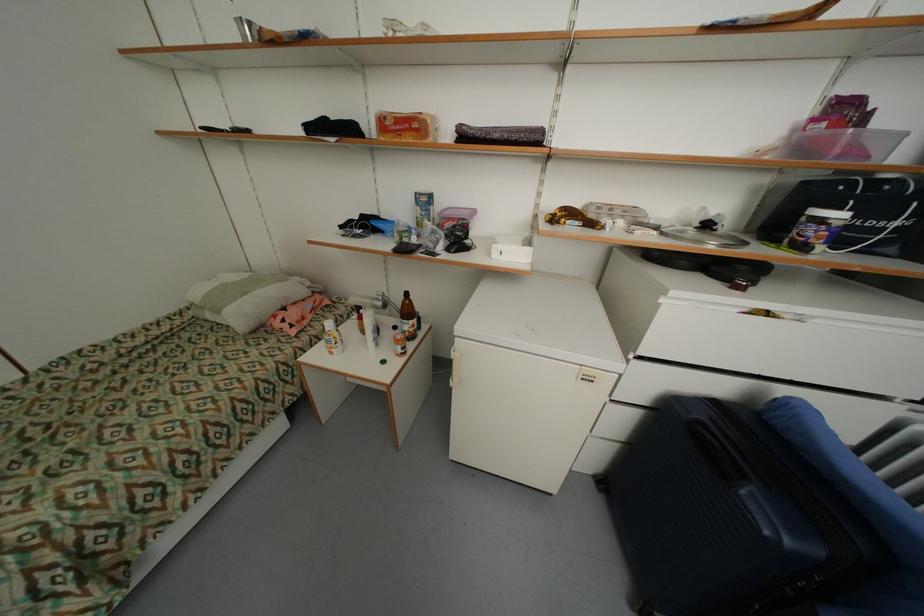
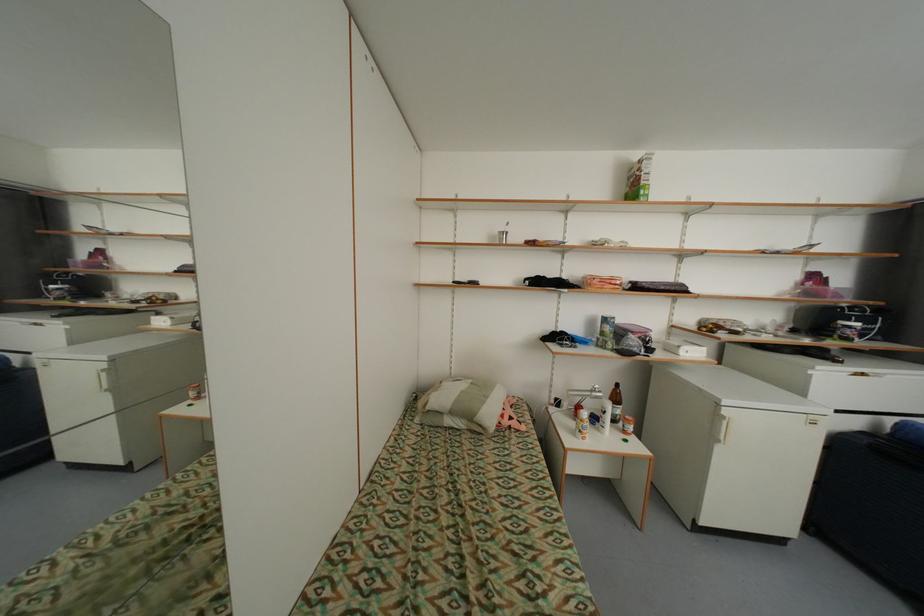
Question: In a continuous first-person perspective shot, in which direction is the camera moving?

Choices:
 (A) Left
 (B) Right
 (C) Forward
 (D) Backward

Answer: (A)